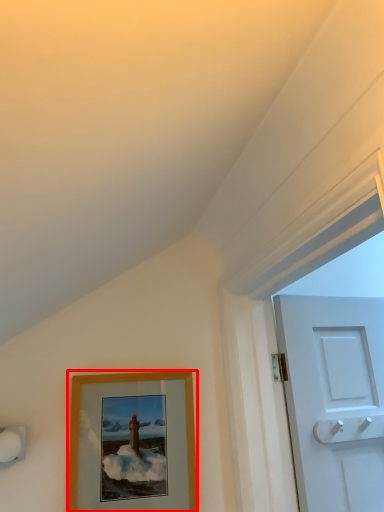
Question: From the image's perspective, where is picture frame (annotated by the red box) located in relation to door handle in the image?

Choices:
 (A) above
 (B) below

Answer: (B)